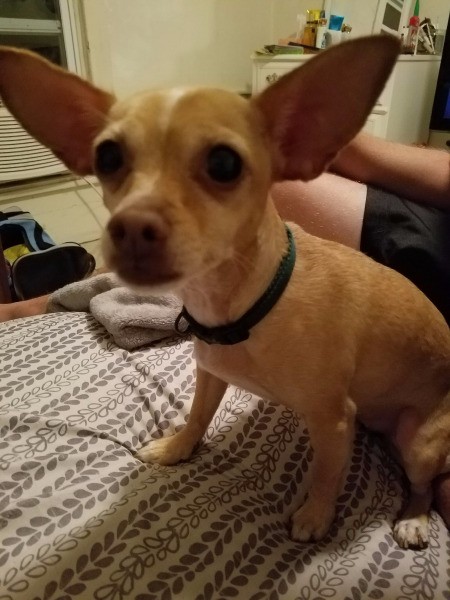
Where is `wall`? wall is located at coordinates (123, 58).